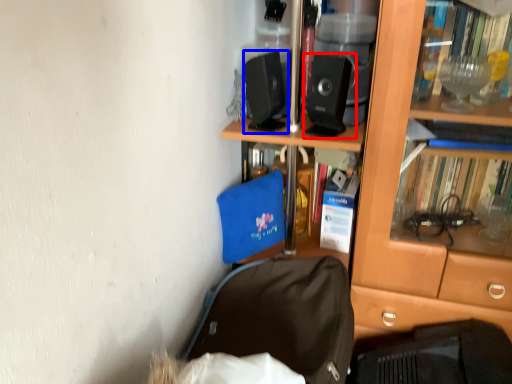
Question: Which point is closer to the camera, loudspeaker (highlighted by a red box) or loudspeaker (highlighted by a blue box)?

Choices:
 (A) loudspeaker
 (B) loudspeaker

Answer: (A)